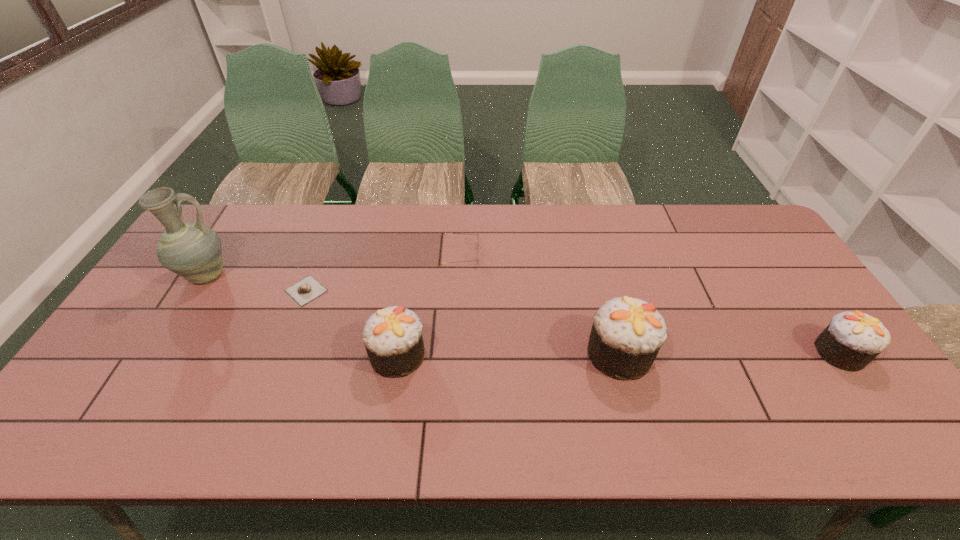
The cupcakes are evenly distributed in the image. To maintain this, where would you place another cupcake on the left? Please point to a free space. Please provide its 2D coordinates. Your answer should be formatted as a tuple, i.e. [(x, y)], where the tuple contains the x and y coordinates of a point satisfying the conditions above.

[(176, 357)]